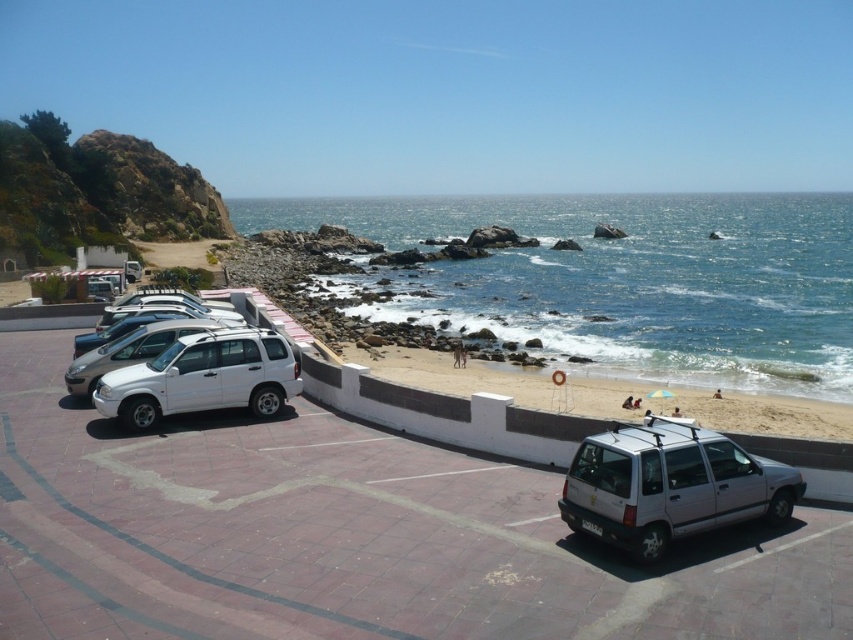
Question: Which point is farther to the camera?

Choices:
 (A) (207, 326)
 (B) (723, 253)
 (C) (196, 360)

Answer: (B)

Question: Which object is farther from the camera taking this photo?

Choices:
 (A) silver metallic minivan at lower right
 (B) white matte suv at left
 (C) white matte suv at center-left
 (D) blue water at lower right

Answer: (D)

Question: Does silver metallic minivan at lower right lie behind white matte suv at left?

Choices:
 (A) no
 (B) yes

Answer: (A)

Question: Is white matte suv at center-left to the left of white matte suv at left from the viewer's perspective?

Choices:
 (A) no
 (B) yes

Answer: (A)

Question: In this image, where is white matte suv at center-left located relative to white matte suv at left?

Choices:
 (A) above
 (B) below

Answer: (B)

Question: Which of these objects is positioned farthest from the blue water at lower right?

Choices:
 (A) white matte suv at center-left
 (B) silver metallic minivan at lower right
 (C) white matte suv at left

Answer: (C)